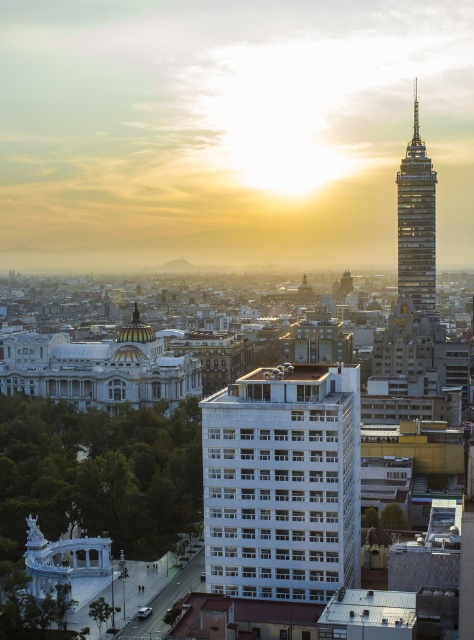
Question: Can you confirm if white smooth building at center is bigger than shiny glass tower at upper right?

Choices:
 (A) yes
 (B) no

Answer: (B)

Question: Is white smooth building at center smaller than shiny glass tower at upper right?

Choices:
 (A) yes
 (B) no

Answer: (A)

Question: Can you confirm if white smooth building at center is positioned below shiny glass tower at upper right?

Choices:
 (A) no
 (B) yes

Answer: (B)

Question: Which object is farther from the camera taking this photo?

Choices:
 (A) shiny glass tower at upper right
 (B) white smooth building at center

Answer: (A)